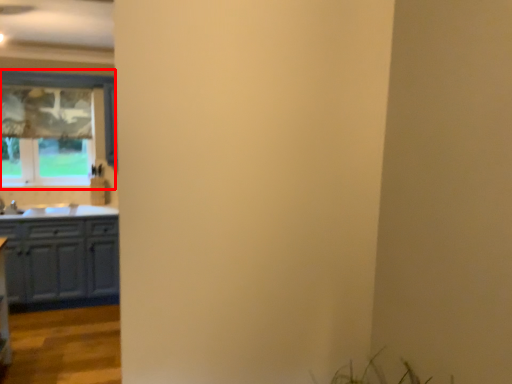
Question: Observing the image, what is the correct spatial positioning of window (annotated by the red box) in reference to cabinetry?

Choices:
 (A) right
 (B) left

Answer: (B)